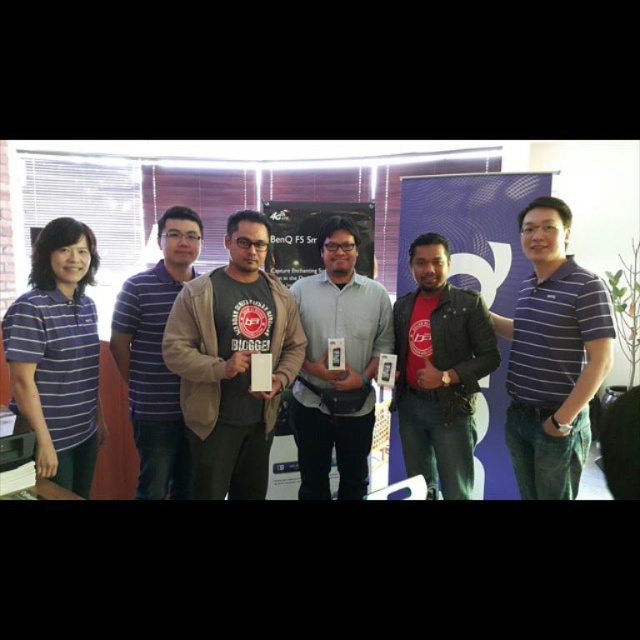
This screenshot has width=640, height=640. Describe the element at coordinates (339, 369) in the screenshot. I see `gray matte shirt at center` at that location.

Who is more forward, (336, 384) or (163, 492)?

Point (336, 384) is in front.

Where is `gray matte shirt at center`? Image resolution: width=640 pixels, height=640 pixels. gray matte shirt at center is located at coordinates (339, 369).

The image size is (640, 640). What are the coordinates of `beige cotton sweater at center` in the screenshot? It's located at (232, 362).

Where is `beige cotton sweater at center`? beige cotton sweater at center is located at coordinates (232, 362).

Between point (268, 448) and point (579, 460), which one is positioned in front?

Point (579, 460)

Does point (224, 449) lie in front of point (548, 497)?

That is True.

Does point (241, 368) come farther from viewer compared to point (582, 371)?

No, (241, 368) is closer to viewer.

This screenshot has width=640, height=640. I want to click on beige cotton sweater at center, so (x=232, y=362).